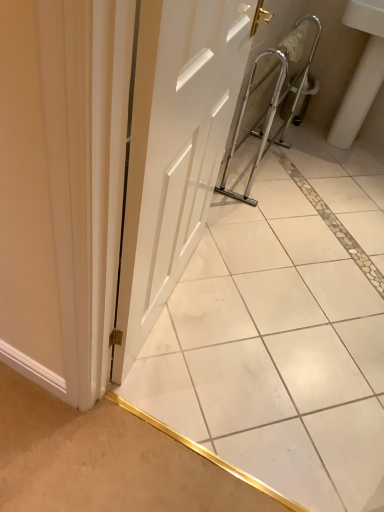
Question: Does white ceramic sink at right have a lesser width compared to white glossy tile at center?

Choices:
 (A) no
 (B) yes

Answer: (A)

Question: Can you confirm if white ceramic sink at right is positioned to the left of white glossy tile at center?

Choices:
 (A) no
 (B) yes

Answer: (A)

Question: From the image's perspective, is white ceramic sink at right located above white glossy tile at center?

Choices:
 (A) yes
 (B) no

Answer: (A)

Question: Considering the relative sizes of white ceramic sink at right and white glossy tile at center in the image provided, is white ceramic sink at right taller than white glossy tile at center?

Choices:
 (A) yes
 (B) no

Answer: (B)

Question: From a real-world perspective, is white ceramic sink at right positioned under white glossy tile at center based on gravity?

Choices:
 (A) no
 (B) yes

Answer: (B)

Question: Is white matte door at center taller or shorter than white glossy tile at center?

Choices:
 (A) short
 (B) tall

Answer: (A)

Question: Looking at their shapes, would you say white matte door at center is wider or thinner than white glossy tile at center?

Choices:
 (A) wide
 (B) thin

Answer: (B)

Question: Considering their positions, is white matte door at center located in front of or behind white glossy tile at center?

Choices:
 (A) behind
 (B) front

Answer: (A)

Question: From a real-world perspective, is white matte door at center positioned above or below white glossy tile at center?

Choices:
 (A) below
 (B) above

Answer: (A)

Question: From a real-world perspective, is white ceramic sink at right positioned above or below white glossy tile at center?

Choices:
 (A) below
 (B) above

Answer: (A)

Question: Is white ceramic sink at right taller or shorter than white glossy tile at center?

Choices:
 (A) short
 (B) tall

Answer: (A)

Question: Which is correct: white ceramic sink at right is inside white glossy tile at center, or outside of it?

Choices:
 (A) inside
 (B) outside

Answer: (B)

Question: From the image's perspective, is white ceramic sink at right above or below white glossy tile at center?

Choices:
 (A) above
 (B) below

Answer: (A)

Question: Considering the positions of white ceramic sink at right and white matte door at center in the image, is white ceramic sink at right wider or thinner than white matte door at center?

Choices:
 (A) thin
 (B) wide

Answer: (B)

Question: Does point (380, 68) appear closer or farther from the camera than point (215, 96)?

Choices:
 (A) farther
 (B) closer

Answer: (A)